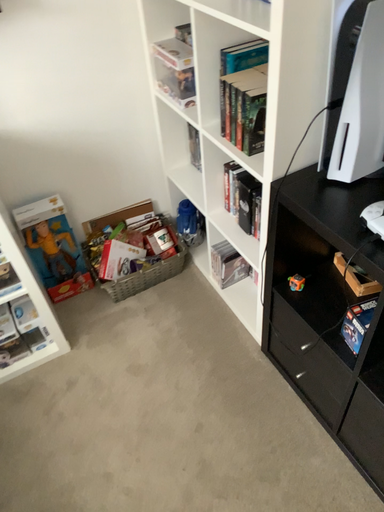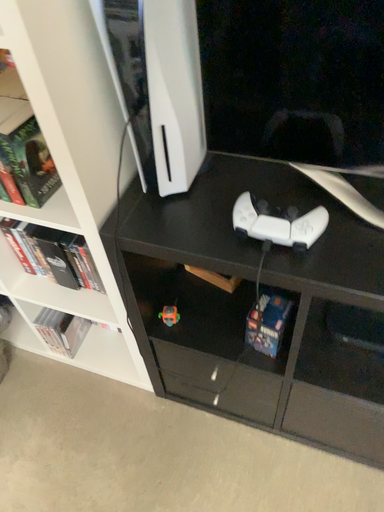
Question: How did the camera likely rotate when shooting the video?

Choices:
 (A) rotated upward
 (B) rotated downward

Answer: (A)